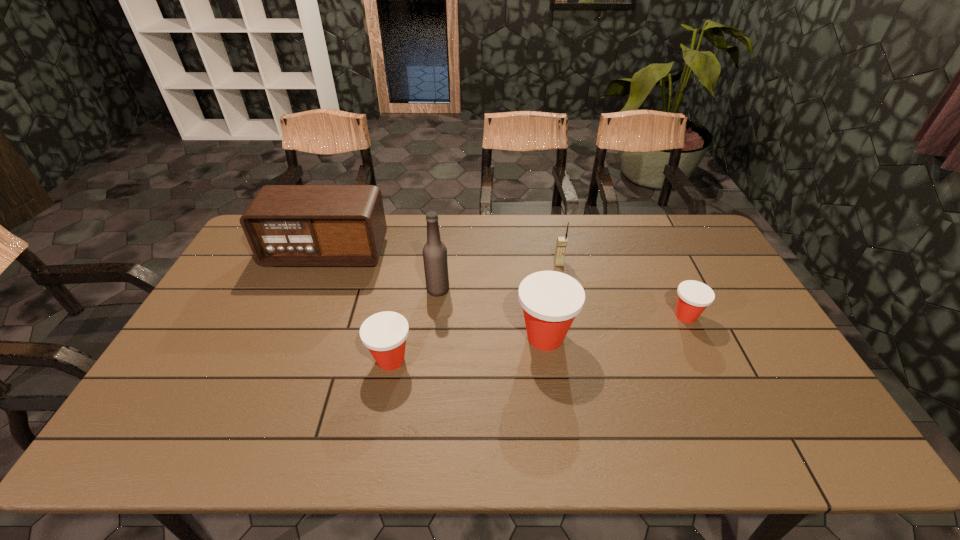
You are a GUI agent. You are given a task and a screenshot of the screen. Output one action in this format:
    pyautogui.click(x=<x>, y=<y>)
    Task: Click on the free region at the left edge
    This screenshot has height=540, width=960.
    Given the screenshot: What is the action you would take?
    pyautogui.click(x=240, y=260)

At what (x,y) coordinates should I click in order to perform the action: click on free space at the right edge of the desktop. Please return your answer as a coordinate pair (x, y). This screenshot has width=960, height=540. Looking at the image, I should click on (696, 260).

The image size is (960, 540). I want to click on blank space at the near left corner of the desktop, so click(198, 403).

The width and height of the screenshot is (960, 540). Find the location of `vacant space at the near right corner of the desktop`. vacant space at the near right corner of the desktop is located at coordinates (807, 403).

At what (x,y) coordinates should I click in order to perform the action: click on vacant area that lies between the beer bottle and the fifth shortest object. Please return your answer as a coordinate pair (x, y). The height and width of the screenshot is (540, 960). Looking at the image, I should click on (382, 271).

At what (x,y) coordinates should I click in order to perform the action: click on vacant space that's between the radio receiver and the leftmost Dixie cup. Please return your answer as a coordinate pair (x, y). Looking at the image, I should click on (359, 306).

Where is `vacant area that lies between the second shortest object and the second Dixie cup from right to left`? Image resolution: width=960 pixels, height=540 pixels. vacant area that lies between the second shortest object and the second Dixie cup from right to left is located at coordinates (468, 348).

Locate an element on the screen. This screenshot has width=960, height=540. blank region between the second shortest object and the beer bottle is located at coordinates (415, 325).

Find the location of a particular element. This screenshot has height=540, width=960. free space between the rightmost object and the fifth shortest object is located at coordinates point(507,285).

The image size is (960, 540). Identify the location of empty space between the fifth tallest object and the cellular telephone. (475, 312).